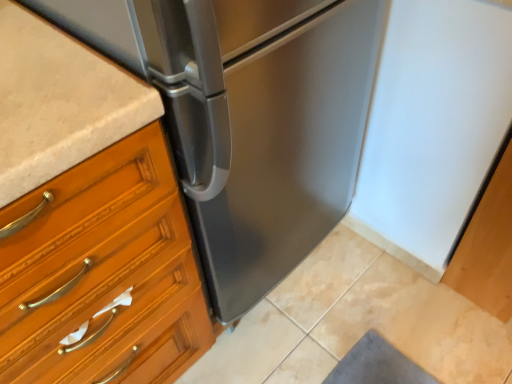
Image resolution: width=512 pixels, height=384 pixels. What do you see at coordinates (102, 274) in the screenshot? I see `matte wood chest of drawers at left` at bounding box center [102, 274].

You are a GUI agent. You are given a task and a screenshot of the screen. Output one action in this format:
    pyautogui.click(x=<x>, y=<y>)
    Task: Click on the matte wood chest of drawers at left
    The image size is (512, 384).
    Given the screenshot: What is the action you would take?
    pyautogui.click(x=102, y=274)

Measure the distance between point (168, 294) and camera.

They are 32.99 inches apart.

I want to click on matte wood chest of drawers at left, so click(x=102, y=274).